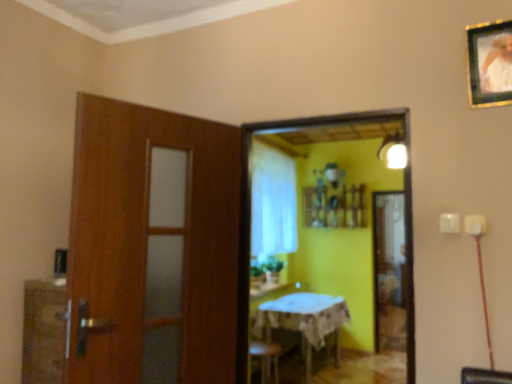
The height and width of the screenshot is (384, 512). I want to click on matte white light fixture at upper right, so click(393, 152).

What is the approximate height of white sheer curtain at center?

4.11 feet.

The width and height of the screenshot is (512, 384). In order to click on wooden framed portrait at upper right in this screenshot , I will do `click(490, 63)`.

From a real-world perspective, is wooden framed mirror at center above or below matte white light fixture at upper right?

wooden framed mirror at center is situated lower than matte white light fixture at upper right in the real world.

Which of these two, wooden framed mirror at center or matte white light fixture at upper right, stands shorter?

With less height is matte white light fixture at upper right.

Can you confirm if wooden framed mirror at center is bigger than matte white light fixture at upper right?

Indeed, wooden framed mirror at center has a larger size compared to matte white light fixture at upper right.

From a real-world perspective, is white sheer curtain at center under wooden framed mirror at center?

No, from a real-world perspective, white sheer curtain at center is not under wooden framed mirror at center.

Which is more to the right, white sheer curtain at center or wooden framed mirror at center?

wooden framed mirror at center is more to the right.

From the image's perspective, is white sheer curtain at center above or below wooden framed mirror at center?

Clearly, from the image's perspective, white sheer curtain at center is above wooden framed mirror at center.

Based on the photo, considering the sizes of white sheer curtain at center and wooden framed portrait at upper right in the image, is white sheer curtain at center taller or shorter than wooden framed portrait at upper right?

Considering their sizes, white sheer curtain at center has more height than wooden framed portrait at upper right.

Is the depth of white sheer curtain at center less than that of wooden framed portrait at upper right?

No, it is behind wooden framed portrait at upper right.

The image size is (512, 384). I want to click on curtain that is below the wooden framed portrait at upper right (from the image's perspective), so click(x=272, y=202).

Which point is more forward, (292, 214) or (486, 69)?

The point (486, 69) is more forward.

Can we say wooden framed portrait at upper right lies outside wooden framed mirror at center?

Indeed, wooden framed portrait at upper right is completely outside wooden framed mirror at center.

In the scene shown: Can you tell me how much wooden framed portrait at upper right and wooden framed mirror at center differ in facing direction?

The angle between the facing direction of wooden framed portrait at upper right and the facing direction of wooden framed mirror at center is 0.847 degrees.

Is wooden framed portrait at upper right far from wooden framed mirror at center?

That's right, there is a large distance between wooden framed portrait at upper right and wooden framed mirror at center.

Measure the distance from wooden framed portrait at upper right to wooden framed mirror at center.

A distance of 3.00 meters exists between wooden framed portrait at upper right and wooden framed mirror at center.

Considering the relative positions of white sheer curtain at center and white cloth-covered table at center in the image provided, is white sheer curtain at center to the left or to the right of white cloth-covered table at center?

Based on their positions, white sheer curtain at center is located to the left of white cloth-covered table at center.

Is white sheer curtain at center taller or shorter than white cloth-covered table at center?

white sheer curtain at center is taller than white cloth-covered table at center.

Is white sheer curtain at center further to camera compared to white cloth-covered table at center?

Yes, it is behind white cloth-covered table at center.

Is white sheer curtain at center not within white cloth-covered table at center?

white sheer curtain at center lies outside white cloth-covered table at center's area.

Is wooden framed portrait at upper right not near matte white light fixture at upper right?

That's right, there is a large distance between wooden framed portrait at upper right and matte white light fixture at upper right.

Is wooden framed portrait at upper right facing towards matte white light fixture at upper right?

No, wooden framed portrait at upper right does not turn towards matte white light fixture at upper right.

Which point is more forward, (487,106) or (393,142)?

The point (487,106) is in front.

This screenshot has height=384, width=512. I want to click on table behind the matte white light fixture at upper right, so click(305, 322).

In the scene shown: From the image's perspective, is white cloth-covered table at center positioned above or below matte white light fixture at upper right?

Clearly, from the image's perspective, white cloth-covered table at center is below matte white light fixture at upper right.

Based on the photo, is white cloth-covered table at center not near matte white light fixture at upper right?

Absolutely, white cloth-covered table at center is distant from matte white light fixture at upper right.

Where is `light fixture lying behind the wooden framed mirror at center`? The height and width of the screenshot is (384, 512). light fixture lying behind the wooden framed mirror at center is located at coordinates (393, 152).

This screenshot has width=512, height=384. I want to click on mirror that is on the right side of white sheer curtain at center, so click(329, 238).

From the image, which object appears to be farther from white cloth-covered table at center, matte white light fixture at upper right or wooden framed mirror at center?

matte white light fixture at upper right is positioned further to the anchor white cloth-covered table at center.

Based on their spatial positions, is white sheer curtain at center or wooden framed mirror at center closer to wooden framed portrait at upper right?

Among the two, white sheer curtain at center is located nearer to wooden framed portrait at upper right.

Looking at the image, which one is located closer to wooden framed portrait at upper right, wooden framed mirror at center or white sheer curtain at center?

white sheer curtain at center lies closer to wooden framed portrait at upper right than the other object.

When comparing their distances from white cloth-covered table at center, does wooden framed portrait at upper right or wooden framed mirror at center seem further?

wooden framed portrait at upper right lies further to white cloth-covered table at center than the other object.

Looking at the image, which one is located further to wooden framed mirror at center, white cloth-covered table at center or white sheer curtain at center?

The object further to wooden framed mirror at center is white cloth-covered table at center.

Consider the image. Based on their spatial positions, is wooden framed portrait at upper right or white sheer curtain at center further from white cloth-covered table at center?

wooden framed portrait at upper right lies further to white cloth-covered table at center than the other object.

Considering their positions, is wooden framed mirror at center positioned closer to white sheer curtain at center than matte white light fixture at upper right?

Among the two, wooden framed mirror at center is located nearer to white sheer curtain at center.

When comparing their distances from matte white light fixture at upper right, does wooden framed mirror at center or white cloth-covered table at center seem further?

white cloth-covered table at center.

At what (x,y) coordinates should I click in order to perform the action: click on light fixture between wooden framed portrait at upper right and white cloth-covered table at center in the up-down direction. Please return your answer as a coordinate pair (x, y). This screenshot has width=512, height=384. Looking at the image, I should click on (393, 152).

Locate an element on the screen. The image size is (512, 384). light fixture positioned between wooden framed portrait at upper right and white sheer curtain at center from near to far is located at coordinates (393, 152).

Where is `mirror positioned between wooden framed portrait at upper right and white sheer curtain at center from near to far`? mirror positioned between wooden framed portrait at upper right and white sheer curtain at center from near to far is located at coordinates (329, 238).

At what (x,y) coordinates should I click in order to perform the action: click on mirror located between wooden framed portrait at upper right and matte white light fixture at upper right in the depth direction. Please return your answer as a coordinate pair (x, y). The image size is (512, 384). Looking at the image, I should click on (329, 238).